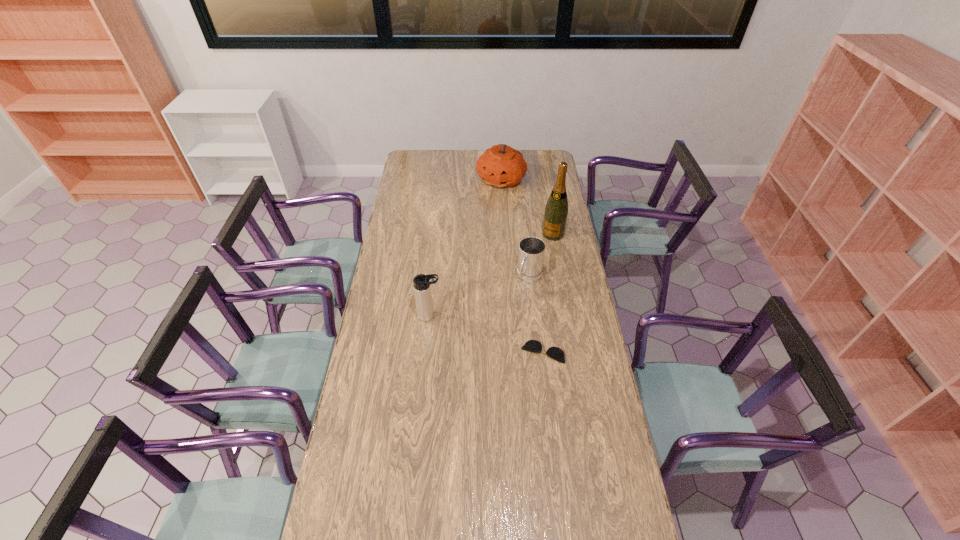
Where is `object that is positioned at the far edge`? Image resolution: width=960 pixels, height=540 pixels. object that is positioned at the far edge is located at coordinates (501, 166).

Locate an element on the screen. This screenshot has width=960, height=540. spectacles at the right edge is located at coordinates (555, 353).

At what (x,y) coordinates should I click in order to perform the action: click on wine bottle that is positioned at the right edge. Please return your answer as a coordinate pair (x, y). The image size is (960, 540). Looking at the image, I should click on (556, 210).

At what (x,y) coordinates should I click in order to perform the action: click on vacant region at the far edge of the desktop. Please return your answer as a coordinate pair (x, y). This screenshot has width=960, height=540. Looking at the image, I should click on (452, 155).

Find the location of a particular element. free space at the left edge is located at coordinates (402, 179).

Locate an element on the screen. The width and height of the screenshot is (960, 540). vacant space at the right edge of the desktop is located at coordinates (568, 328).

This screenshot has width=960, height=540. I want to click on vacant space at the far right corner of the desktop, so click(542, 153).

You are a GUI agent. You are given a task and a screenshot of the screen. Output one action in this format:
    pyautogui.click(x=<x>, y=<y>)
    Task: Click on the vacant area that lies between the third nearest object and the farthest object
    This screenshot has height=540, width=960.
    Given the screenshot: What is the action you would take?
    pyautogui.click(x=516, y=228)

Identify the location of free point between the tallest object and the leftmost object. (492, 275).

In order to click on empty space that is in between the fourth farthest object and the farthest object in this screenshot , I will do `click(466, 248)`.